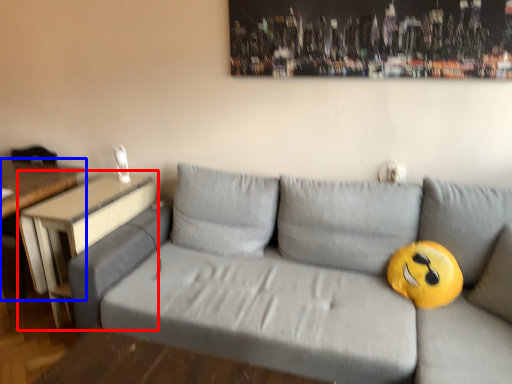
Question: Which object appears closest to the camera in this image, table (highlighted by a red box) or table (highlighted by a blue box)?

Choices:
 (A) table
 (B) table

Answer: (A)